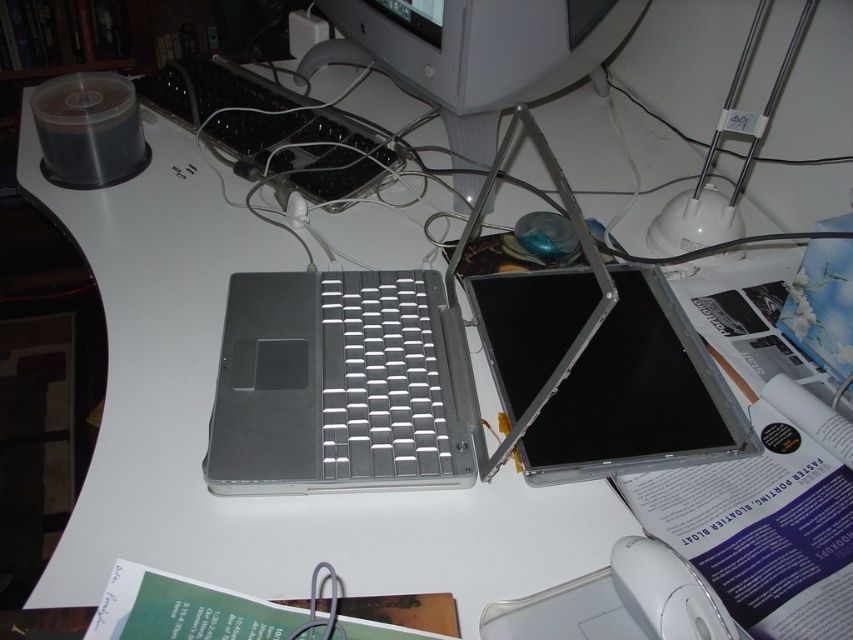
You are a technician working on the laptop. You need to place a new cable connector at point (268,128). However, there is an object already present at that location. What object is blocking the way?

The silver metallic keyboard at center is located at point (268,128), so it is blocking the way.

You are organizing the desk and need to place a new item between the silver metallic keyboard at center and the white plastic mouse at lower right. Is there enough vertical space between them to fit the item?

The silver metallic keyboard at center is above the white plastic mouse at lower right, so there is vertical space between them. However, the exact amount of space isn not specified, so it depends on the item size.

You are standing in front of the desk and want to place a new keyboard on the desk. The new keyboard is 10 cm long. The point representing the silver metallic laptop at center is located at coordinates (366, 372). The desk has a total length of 1 meter. Can the new keyboard be placed on the desk without overlapping the silver metallic laptop at center?

The silver metallic laptop at center is represented by the point at coordinates (366, 372). Since the desk is 1 meter long and the keyboard is only 10 cm long, there should be enough space to place the keyboard on the desk without overlapping the silver metallic laptop at center as long as it is positioned appropriately away from the laptop point.